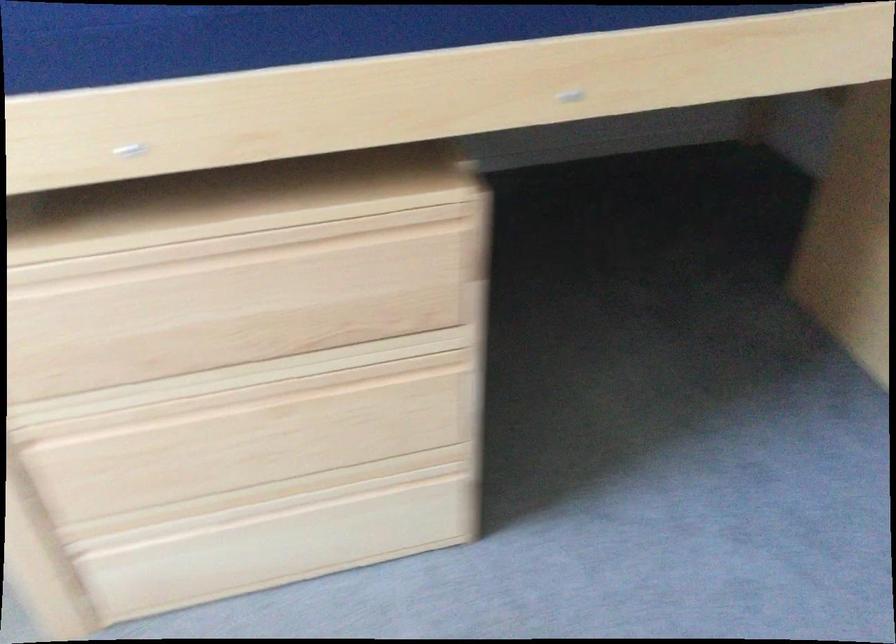
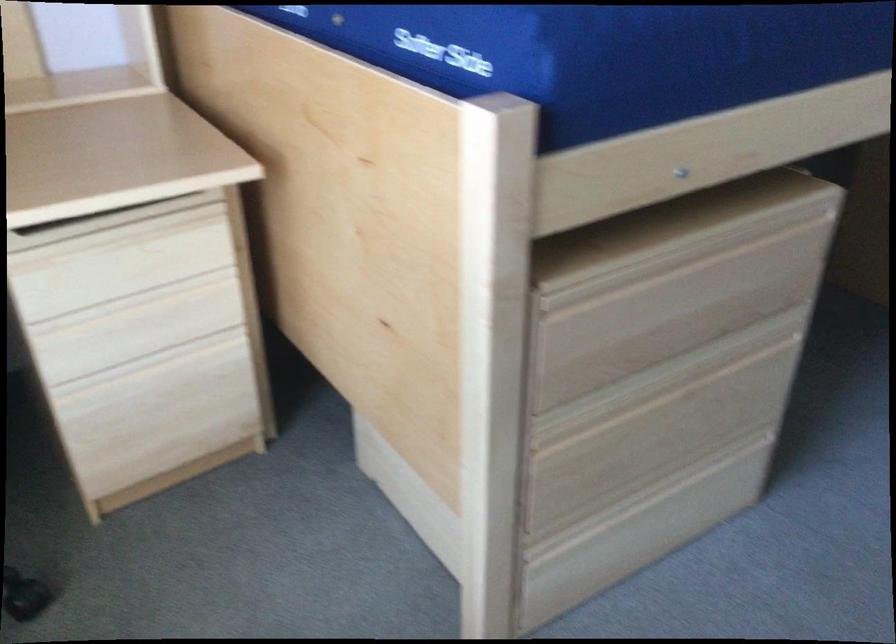
In the second image, find the point that corresponds to point (265, 383) in the first image.

(673, 377)